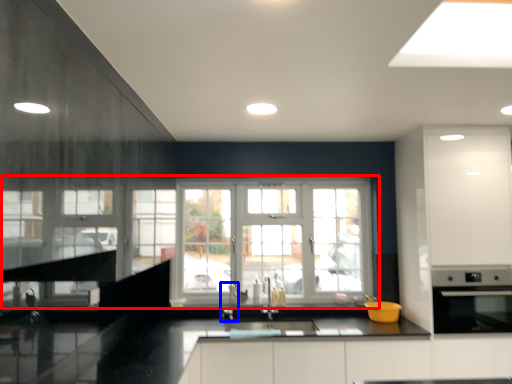
Question: Which object is closer to the camera taking this photo, window (highlighted by a red box) or faucet (highlighted by a blue box)?

Choices:
 (A) window
 (B) faucet

Answer: (B)